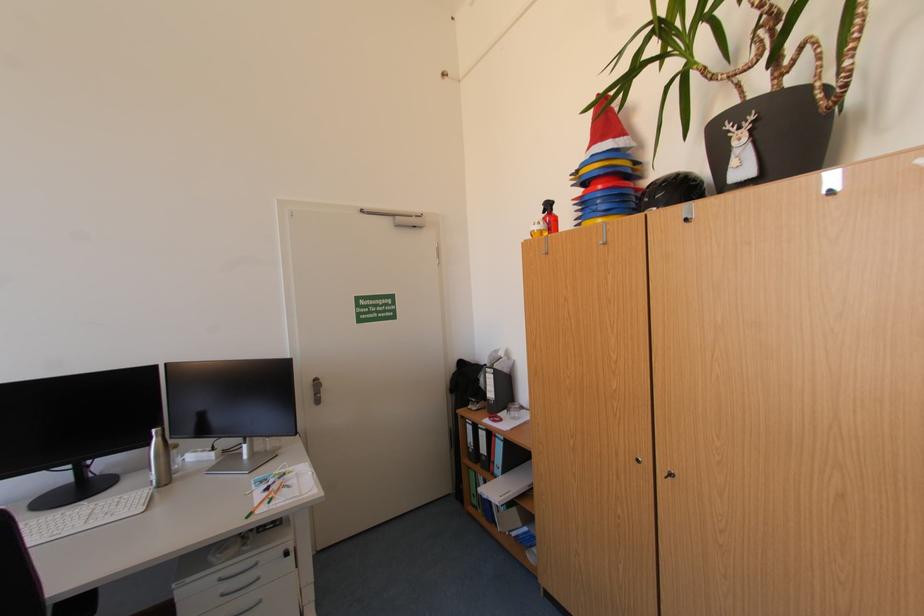
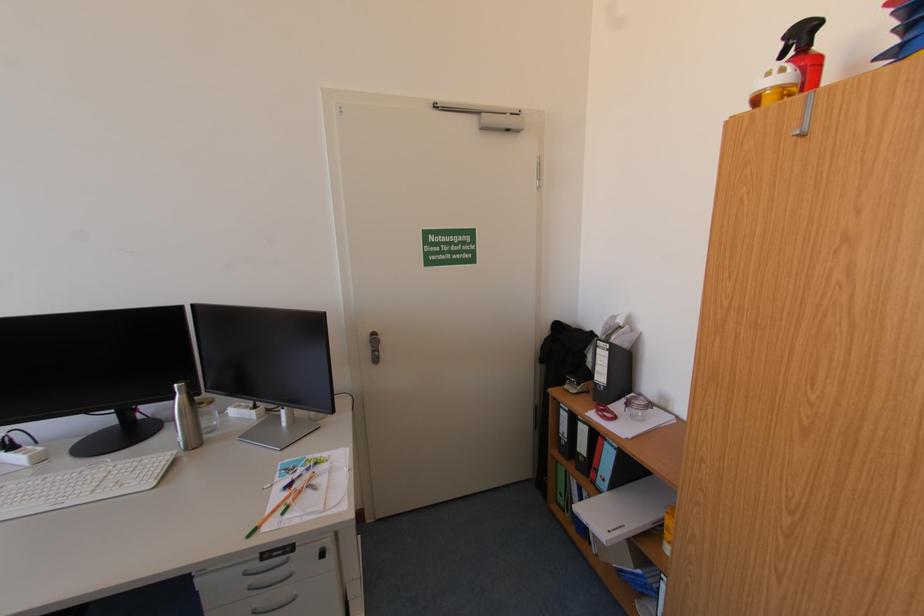
Question: The camera is either moving clockwise (left) or counter-clockwise (right) around the object. The first image is from the beginning of the video and the second image is from the end. Is the camera moving left or right when shooting the video?

Choices:
 (A) Left
 (B) Right

Answer: (B)